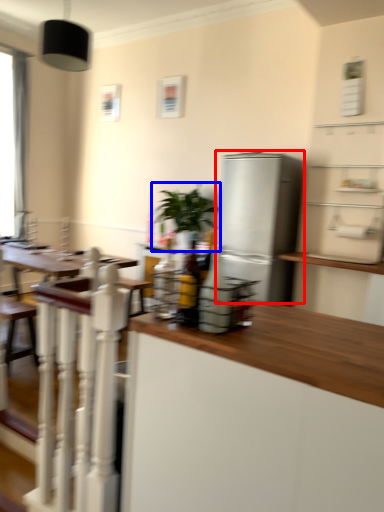
Question: Which object appears farthest to the camera in this image, refrigerator (highlighted by a red box) or houseplant (highlighted by a blue box)?

Choices:
 (A) refrigerator
 (B) houseplant

Answer: (B)